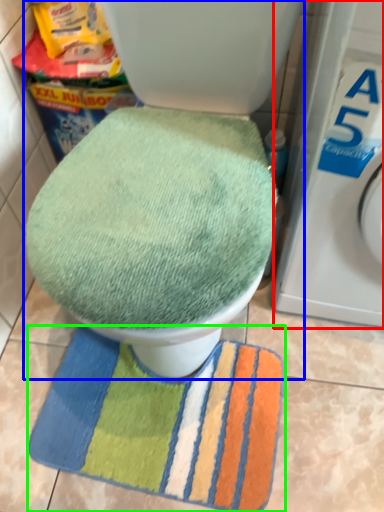
Question: Estimate the real-world distances between objects in this image. Which object is farther from washing machine (highlighted by a red box), toilet (highlighted by a blue box) or beach towel (highlighted by a green box)?

Choices:
 (A) toilet
 (B) beach towel

Answer: (B)